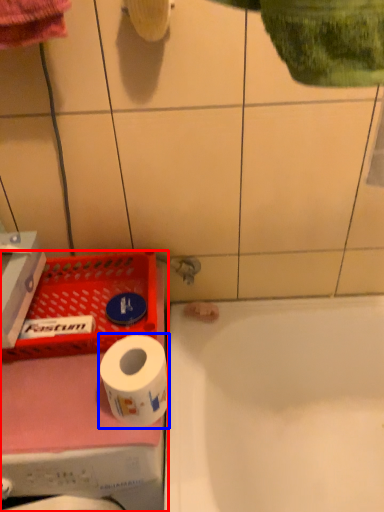
Question: Which object is closer to the camera taking this photo, washing machine (highlighted by a red box) or toilet paper (highlighted by a blue box)?

Choices:
 (A) washing machine
 (B) toilet paper

Answer: (A)